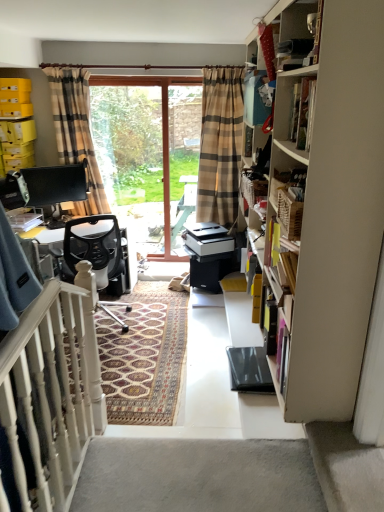
Find the location of a particular element. free space above white carpet at lower right (from a real-world perspective) is located at coordinates (350, 460).